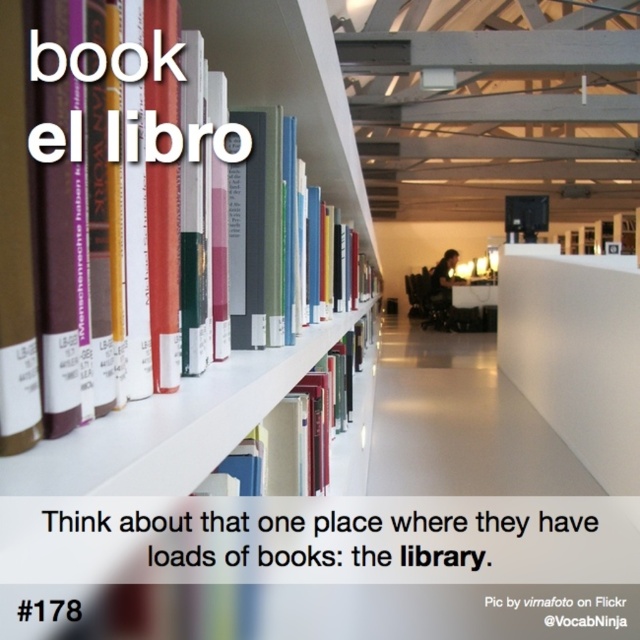
Is hardcover books at left above hardcover book at center?

Correct, hardcover books at left is located above hardcover book at center.

Is point (243, 51) behind point (330, 332)?

No, it is in front of (330, 332).

Identify the location of hardcover books at left. (291, 84).

Does hardcover book at center appear on the left side of dark brown hair at center?

Indeed, hardcover book at center is positioned on the left side of dark brown hair at center.

Which is above, hardcover book at center or dark brown hair at center?

dark brown hair at center is higher up.

Locate an element on the screen. This screenshot has width=640, height=640. hardcover book at center is located at coordinates pos(320,332).

Is hardcover books at left above dark brown hair at center?

Correct, hardcover books at left is located above dark brown hair at center.

Describe the element at coordinates (291, 84) in the screenshot. The width and height of the screenshot is (640, 640). I see `hardcover books at left` at that location.

Identify the location of hardcover books at left. The width and height of the screenshot is (640, 640). (291, 84).